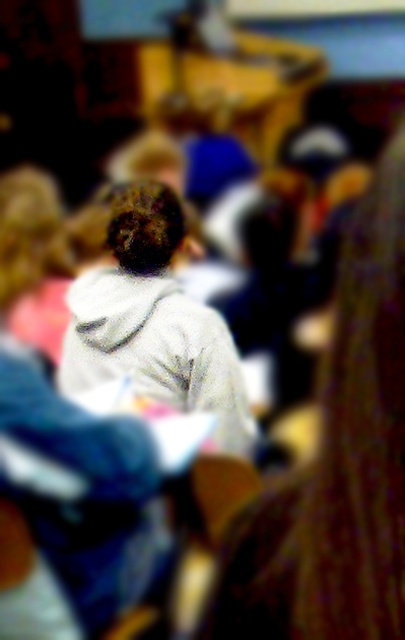
Based on the scene description, where is the white fleece hoodie at center located in terms of coordinates?

The white fleece hoodie at center is located at coordinates point (338, 465).